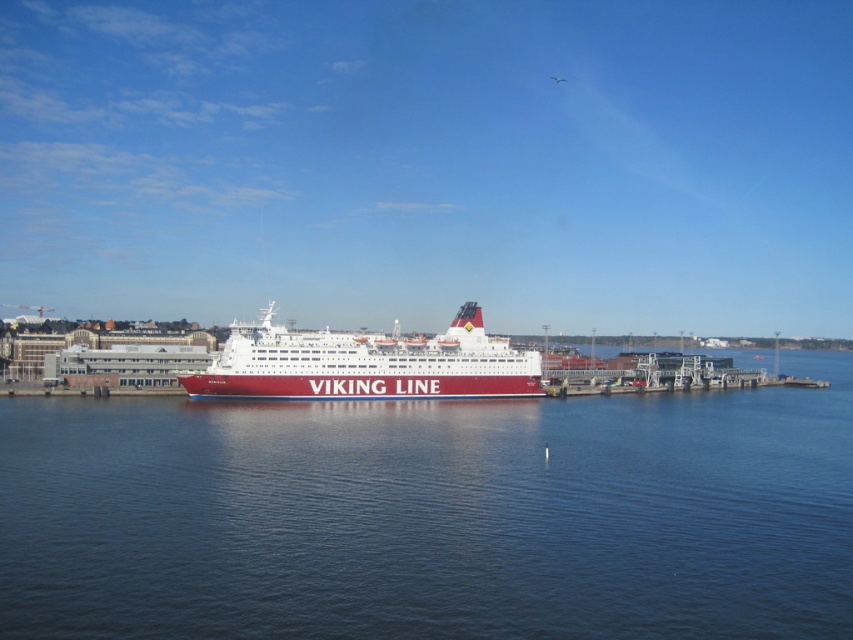
Who is more forward, (601, 513) or (213, 378)?

Positioned in front is point (601, 513).

Does point (749, 621) come farther from viewer compared to point (404, 378)?

No, it is not.

Where is `blue water at center`? This screenshot has width=853, height=640. blue water at center is located at coordinates (432, 515).